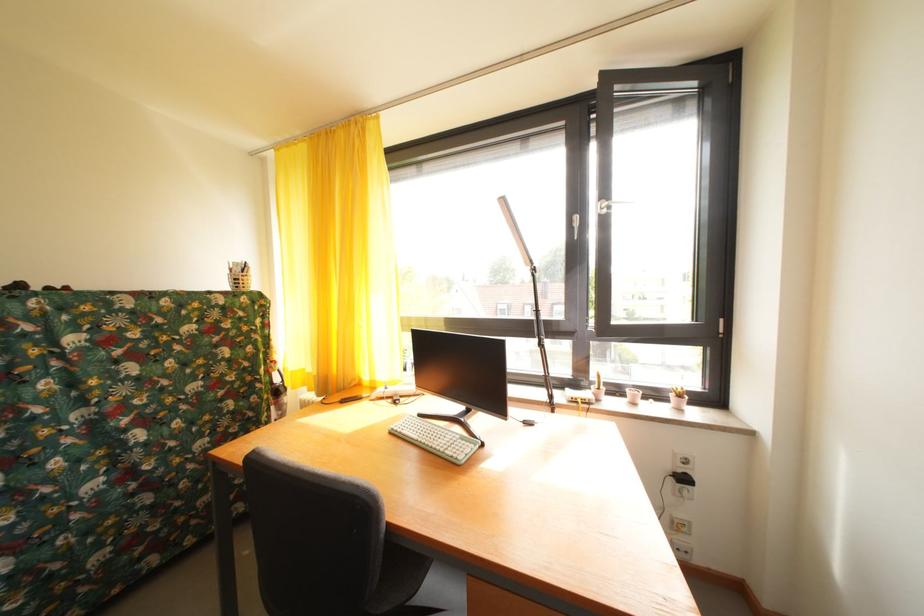
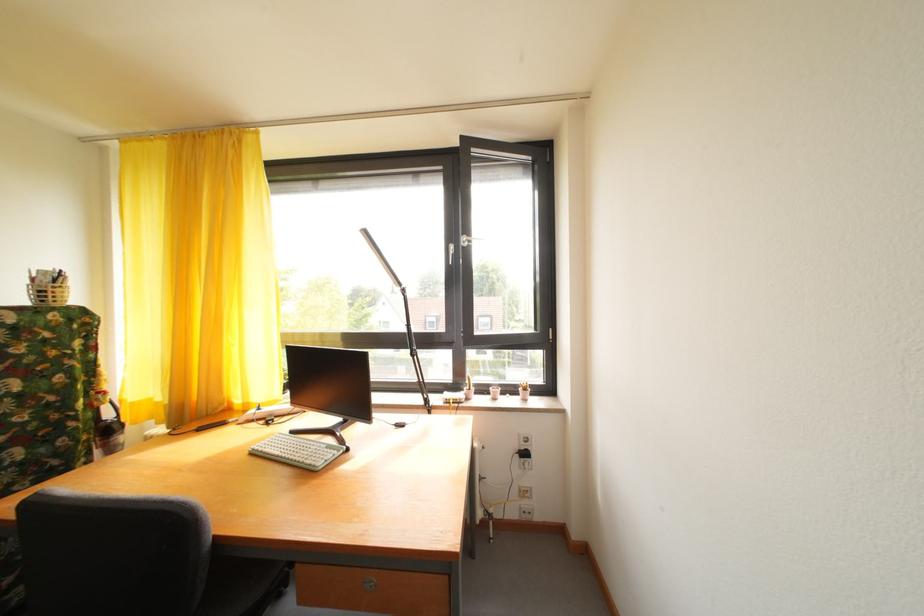
In the second image, find the point that corresponds to point (664, 400) in the first image.

(520, 395)